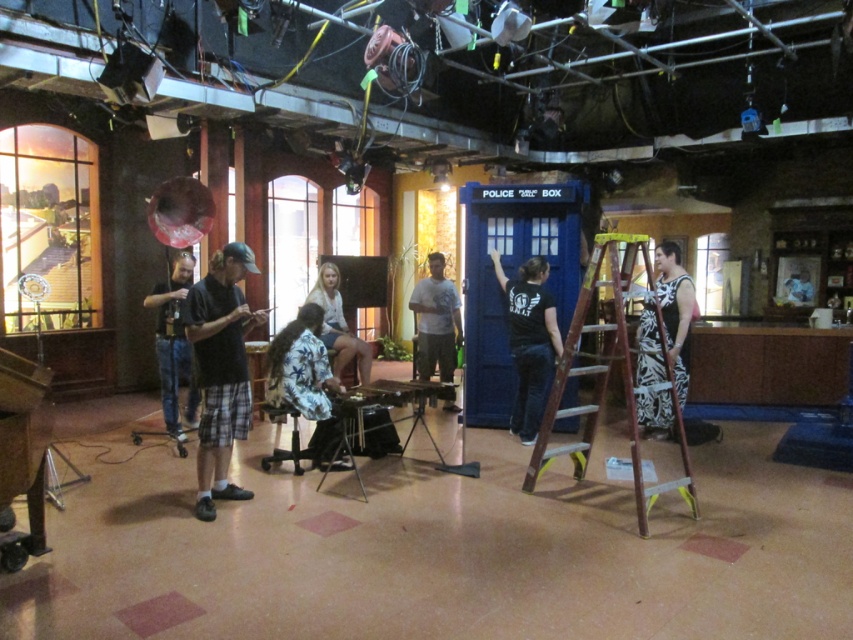
Question: Can you confirm if black plaid shorts at center is wider than light brown fabric skirt at center?

Choices:
 (A) yes
 (B) no

Answer: (B)

Question: Which point is farther to the camera?

Choices:
 (A) (231, 422)
 (B) (610, 256)

Answer: (A)

Question: Is black and white striped dress at right wider than denim shorts at left?

Choices:
 (A) yes
 (B) no

Answer: (A)

Question: Does brown wooden ladder at center lie behind light brown fabric skirt at center?

Choices:
 (A) no
 (B) yes

Answer: (A)

Question: Which object appears farthest from the camera in this image?

Choices:
 (A) white matte shirt at center
 (B) black and white striped dress at right

Answer: (A)

Question: Which point appears closest to the camera in this image?

Choices:
 (A) (514, 305)
 (B) (199, 344)

Answer: (B)